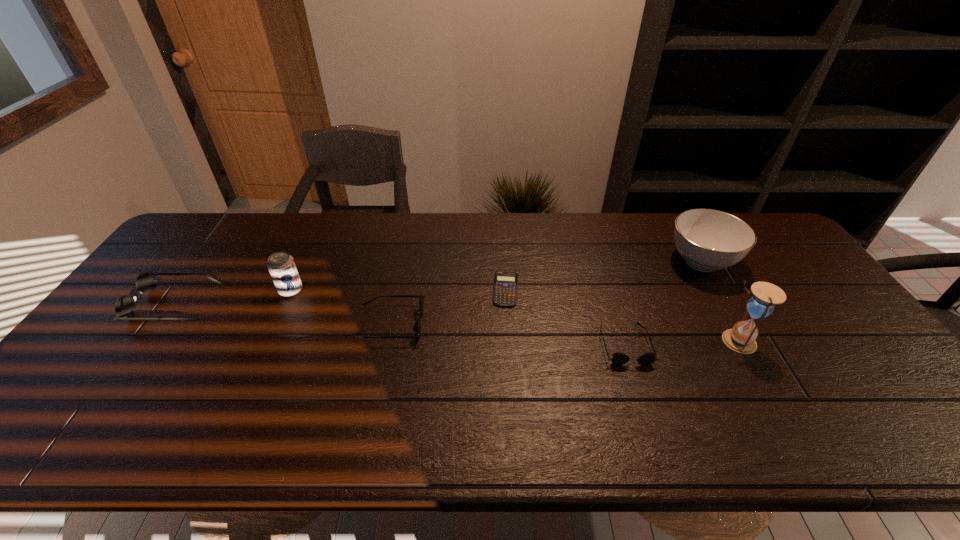
Where is `vacant area that lies between the tallest object and the third object from right to left`? The width and height of the screenshot is (960, 540). vacant area that lies between the tallest object and the third object from right to left is located at coordinates (x=681, y=343).

Locate an element on the screen. The width and height of the screenshot is (960, 540). vacant region between the shortest object and the beer can is located at coordinates (398, 290).

You are a GUI agent. You are given a task and a screenshot of the screen. Output one action in this format:
    pyautogui.click(x=<x>, y=<y>)
    Task: Click on the free space between the chinaware and the fifth object from left to right
    This screenshot has width=960, height=540.
    Given the screenshot: What is the action you would take?
    pyautogui.click(x=663, y=303)

Locate an element on the screen. The height and width of the screenshot is (540, 960). object that is the fifth closest to the hourglass is located at coordinates (282, 268).

Image resolution: width=960 pixels, height=540 pixels. Identify the location of object that stands as the closest to the tallest object. (708, 240).

At what (x,y) coordinates should I click in order to perform the action: click on sunglasses that is the second closest to the second sunglasses from left to right. Please return your answer as a coordinate pair (x, y). Looking at the image, I should click on (618, 358).

Where is `the second closest sunglasses to the fifth object from left to right`? The width and height of the screenshot is (960, 540). the second closest sunglasses to the fifth object from left to right is located at coordinates (124, 308).

You are a GUI agent. You are given a task and a screenshot of the screen. Output one action in this format:
    pyautogui.click(x=<x>, y=<y>)
    Task: Click on the vacant region that satisfies the following two spatial constraints: 1. on the front side of the shortest object; 2. on the front-facing side of the third shortest object
    
    Given the screenshot: What is the action you would take?
    pyautogui.click(x=508, y=323)

Find the location of `vacant point that satisfies the following two spatial constraints: 1. on the front side of the chinaware; 2. on the front-facing side of the second sunglasses from left to right`. vacant point that satisfies the following two spatial constraints: 1. on the front side of the chinaware; 2. on the front-facing side of the second sunglasses from left to right is located at coordinates (737, 323).

Locate an element on the screen. blank area in the image that satisfies the following two spatial constraints: 1. on the back side of the hourglass; 2. on the front-facing side of the fourth shortest object is located at coordinates (715, 303).